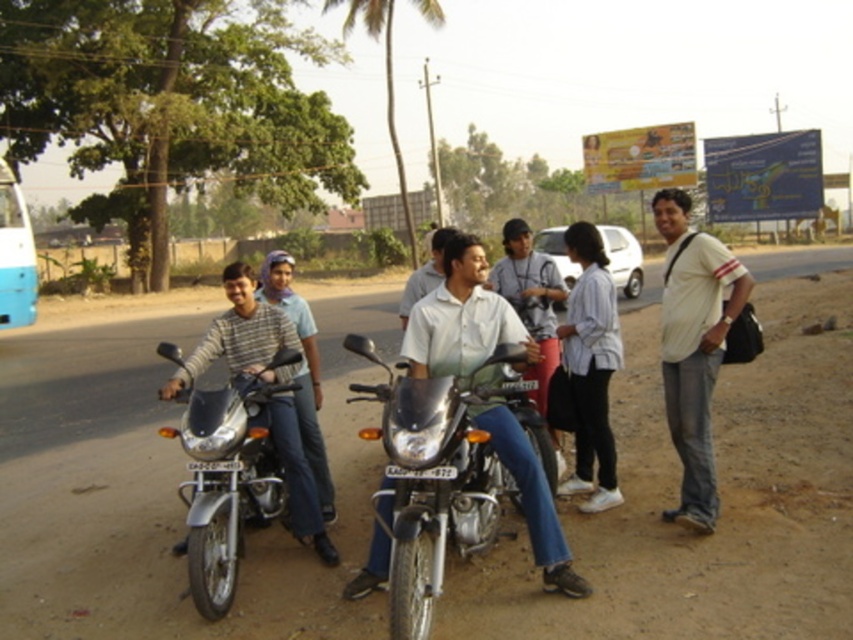
Question: Considering the real-world distances, which object is closest to the shiny metallic motorcycle at left?

Choices:
 (A) light blue shirt at center
 (B) matte silver motorcycle at center
 (C) metallic silver motorcycle at center
 (D) white striped shirt at right

Answer: (C)

Question: Is shiny metallic motorcycle at left thinner than matte black motorcycle at left?

Choices:
 (A) yes
 (B) no

Answer: (B)

Question: Is white striped shirt at right wider than matte silver motorcycle at center?

Choices:
 (A) no
 (B) yes

Answer: (B)

Question: Which of the following is the farthest from the observer?

Choices:
 (A) (503, 360)
 (B) (442, 234)
 (C) (508, 291)
 (D) (675, 276)

Answer: (C)

Question: In this image, where is metallic silver motorcycle at center located relative to white striped shirt at right?

Choices:
 (A) above
 (B) below

Answer: (B)

Question: Estimate the real-world distances between objects in this image. Which object is closer to the shiny metallic motorcycle at left?

Choices:
 (A) white striped shirt at right
 (B) light blue shirt at center

Answer: (A)